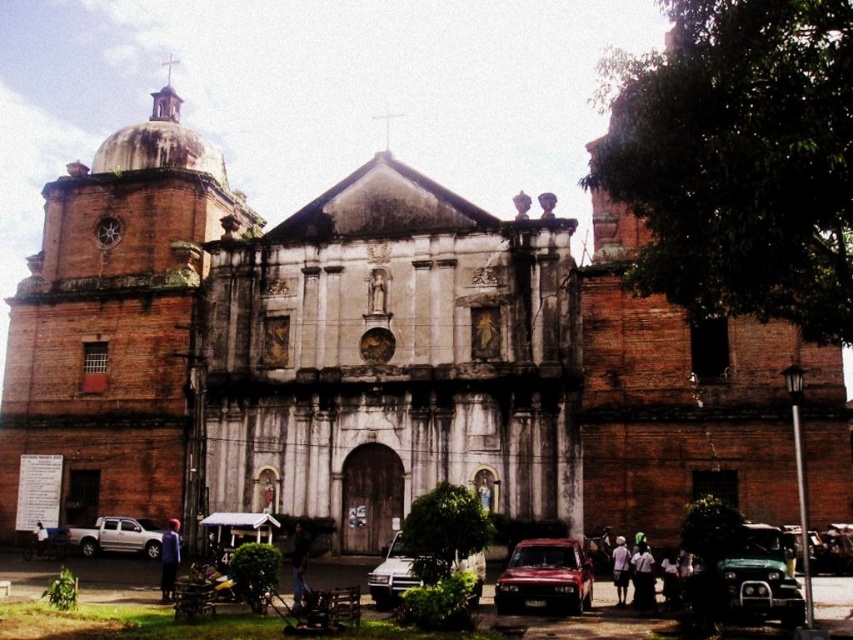
Which is more to the right, silver metallic pickup truck at lower left or blue fabric shirt at lower left?

blue fabric shirt at lower left is more to the right.

You are a GUI agent. You are given a task and a screenshot of the screen. Output one action in this format:
    pyautogui.click(x=<x>, y=<y>)
    Task: Click on the silver metallic pickup truck at lower left
    This screenshot has width=853, height=640.
    Given the screenshot: What is the action you would take?
    pyautogui.click(x=117, y=536)

Where is `silver metallic pickup truck at lower left`? silver metallic pickup truck at lower left is located at coordinates click(117, 536).

Is silver metallic sedan at center thinner than dark blue fabric at lower center?

Incorrect, silver metallic sedan at center's width is not less than dark blue fabric at lower center's.

Can you confirm if silver metallic sedan at center is positioned above dark blue fabric at lower center?

No, silver metallic sedan at center is not above dark blue fabric at lower center.

Locate an element on the screen. This screenshot has height=640, width=853. silver metallic sedan at center is located at coordinates (392, 576).

Is light brown leather jacket at lower center positioned in front of white fabric shirt at lower left?

Yes, it is in front of white fabric shirt at lower left.

In the scene shown: Measure the distance between light brown leather jacket at lower center and white fabric shirt at lower left.

light brown leather jacket at lower center is 144.17 feet from white fabric shirt at lower left.

Does point (619, 595) lie behind point (41, 532)?

No, (619, 595) is in front of (41, 532).

At what (x,y) coordinates should I click in order to perform the action: click on light brown leather jacket at lower center. Please return your answer as a coordinate pair (x, y). This screenshot has width=853, height=640. Looking at the image, I should click on (619, 570).